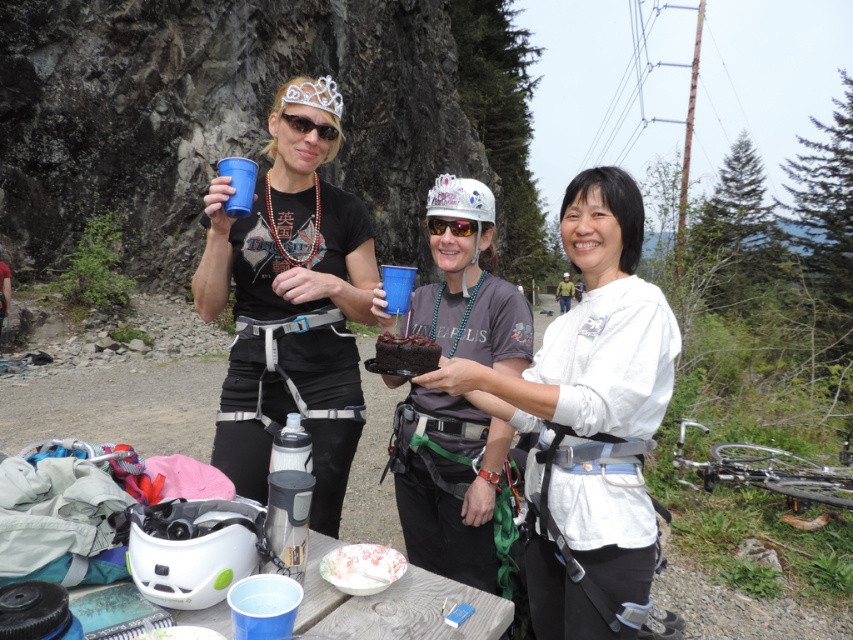
Question: Which of these objects is positioned closest to the matte black helmet at center?

Choices:
 (A) white matte helmet at center
 (B) chocolate cake at center
 (C) matte black t-shirt at center
 (D) black plastic goggles at center

Answer: (B)

Question: Which of these objects is positioned farthest from the matte black helmet at center?

Choices:
 (A) white matte helmet at center
 (B) matte black t-shirt at center

Answer: (A)

Question: Among these objects, which one is nearest to the camera?

Choices:
 (A) matte black helmet at center
 (B) chocolate cake at center
 (C) white plastic helmet at lower center

Answer: (C)

Question: Does white plastic helmet at lower center appear under black plastic goggles at center?

Choices:
 (A) yes
 (B) no

Answer: (A)

Question: Is matte black helmet at center above black plastic goggles at center?

Choices:
 (A) no
 (B) yes

Answer: (A)

Question: Does matte black t-shirt at center have a smaller size compared to white plastic helmet at lower center?

Choices:
 (A) no
 (B) yes

Answer: (A)